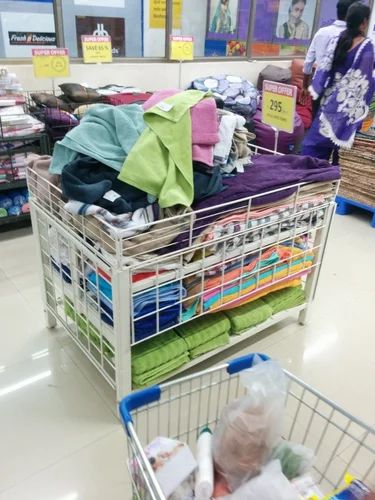
Image resolution: width=375 pixels, height=500 pixels. In order to click on pile of multicolored towels in this screenshot , I will do `click(178, 154)`.